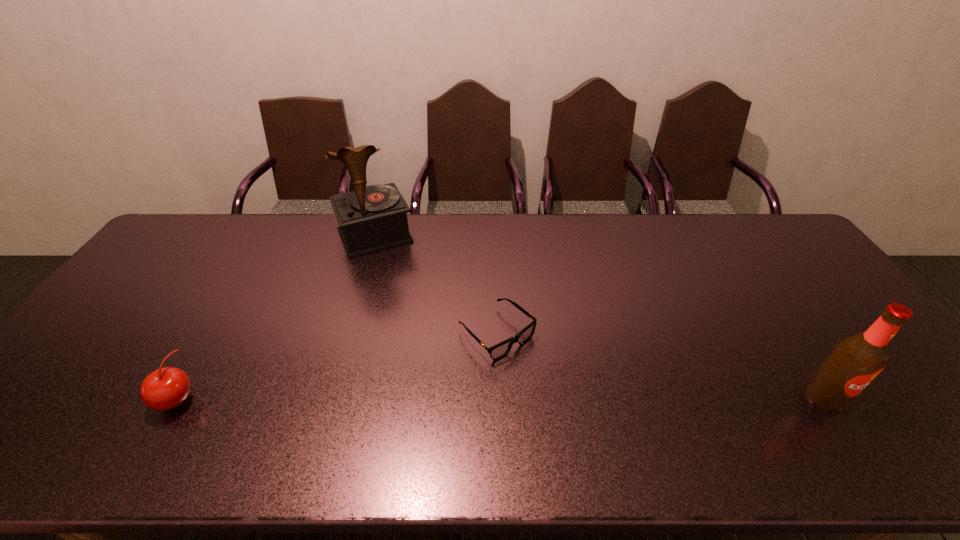
Find the location of a particular element. vacant position located 0.230m at the horn opening of the phonograph_record is located at coordinates (408, 303).

Where is `vacant area situated 0.330m at the horn opening of the phonograph_record`? Image resolution: width=960 pixels, height=540 pixels. vacant area situated 0.330m at the horn opening of the phonograph_record is located at coordinates (419, 327).

I want to click on free location located 0.120m at the horn opening of the phonograph_record, so tap(396, 280).

This screenshot has width=960, height=540. In order to click on free location located on the front-facing side of the shortest object in this screenshot , I will do `click(547, 381)`.

Where is `vacant space located on the front-facing side of the shortest object`? The width and height of the screenshot is (960, 540). vacant space located on the front-facing side of the shortest object is located at coordinates (547, 381).

The height and width of the screenshot is (540, 960). Find the location of `free space located on the front-facing side of the shortest object`. free space located on the front-facing side of the shortest object is located at coordinates (553, 386).

Find the location of `object that is at the far edge`. object that is at the far edge is located at coordinates (373, 218).

Find the location of a particular element. The height and width of the screenshot is (540, 960). cherry that is positioned at the near edge is located at coordinates (166, 388).

Find the location of a particular element. This screenshot has width=960, height=540. beer bottle located at the near edge is located at coordinates (855, 361).

In the image, there is a desktop. Where is `vacant area at the far edge`? vacant area at the far edge is located at coordinates (215, 254).